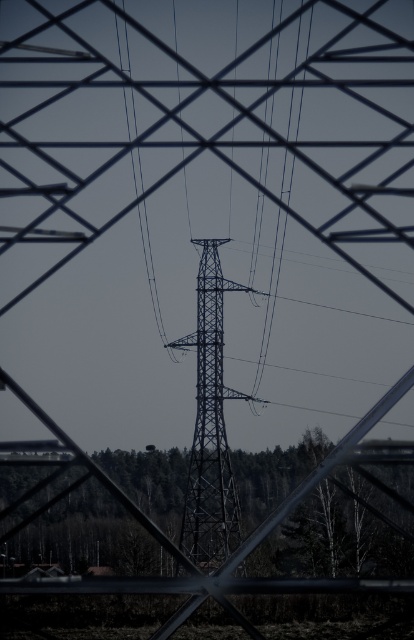
You are an engineer inspecting the power lines. You notice the metallic structure at center and the blue wire at center. Which one has a greater height in this scene?

The blue wire at center is taller than the metallic structure at center.

You are an engineer inspecting the power lines. You notice the metallic structure at center and the black wire at center in the image. Which one takes up more area in the scene?

The black wire at center takes up more area than the metallic structure at center because the metallic structure at center occupies less space than black wire at center.